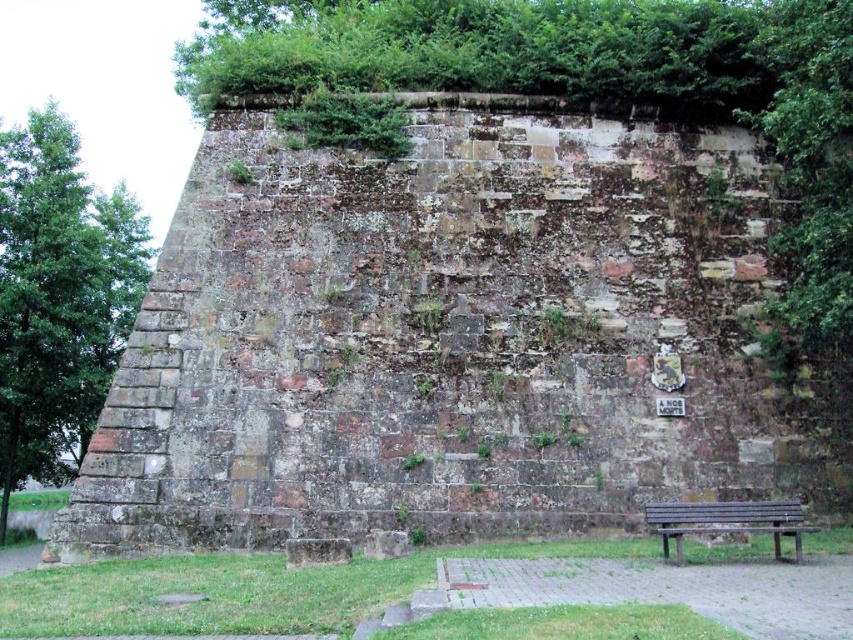
You are standing on the flat grassy area at the top of the brown stone wall at center. You want to reach the green leafy tree at left. Which direction should you move to get closer to the tree?

Since the brown stone wall at center is below the green leafy tree at left, you should move upward towards the green leafy tree at left to get closer.

You are standing in front of the brown stone wall at center and the green leafy tree at left. Which object is taller?

The green leafy tree at left is taller than the brown stone wall at center.

You are standing at the point marked by the coordinates [444,337] in the image of the old stone wall. Based on the scene description, what surface are you most likely standing on?

You are standing on the brown stone wall at center, as the point coordinates indicate that location.